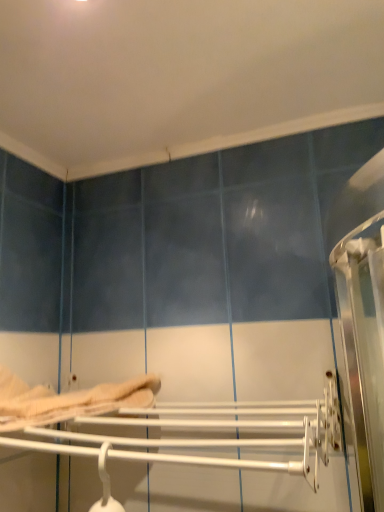
Describe the element at coordinates (67, 400) in the screenshot. Image resolution: width=384 pixels, height=512 pixels. I see `beige fabric bed at lower left` at that location.

Where is `beige fabric bed at lower left`? This screenshot has height=512, width=384. beige fabric bed at lower left is located at coordinates pos(67,400).

Image resolution: width=384 pixels, height=512 pixels. Describe the element at coordinates (179, 428) in the screenshot. I see `white glossy towel rack at center` at that location.

Measure the distance between point (244, 438) and camera.

Point (244, 438) and camera are 26.85 inches apart from each other.

At what (x,y) coordinates should I click in order to perform the action: click on white glossy towel rack at center. Please return your answer as a coordinate pair (x, y). Looking at the image, I should click on (179, 428).

Identify the location of beige fabric bed at lower left. (67, 400).

Can you confirm if white glossy towel rack at center is positioned to the left of beige fabric bed at lower left?

No.

In the image, is white glossy towel rack at center positioned in front of or behind beige fabric bed at lower left?

In the image, white glossy towel rack at center appears in front of beige fabric bed at lower left.

Does point (184, 415) come closer to viewer compared to point (140, 396)?

That is True.

Based on the photo, from the image's perspective, is white glossy towel rack at center above beige fabric bed at lower left?

Incorrect, from the image's perspective, white glossy towel rack at center is lower than beige fabric bed at lower left.

Consider the image. From a real-world perspective, who is located higher, white glossy towel rack at center or beige fabric bed at lower left?

beige fabric bed at lower left, from a real-world perspective.

Considering the relative sizes of white glossy towel rack at center and beige fabric bed at lower left in the image provided, is white glossy towel rack at center wider than beige fabric bed at lower left?

Yes, white glossy towel rack at center is wider than beige fabric bed at lower left.

Who is taller, white glossy towel rack at center or beige fabric bed at lower left?

white glossy towel rack at center.

Does white glossy towel rack at center have a larger size compared to beige fabric bed at lower left?

Yes, white glossy towel rack at center is bigger than beige fabric bed at lower left.

Is white glossy towel rack at center situated inside beige fabric bed at lower left or outside?

white glossy towel rack at center is not enclosed by beige fabric bed at lower left.

Is white glossy towel rack at center far from beige fabric bed at lower left?

No, there isn't a large distance between white glossy towel rack at center and beige fabric bed at lower left.

Does white glossy towel rack at center turn towards beige fabric bed at lower left?

No, white glossy towel rack at center does not turn towards beige fabric bed at lower left.

In the scene shown: How many degrees apart are the facing directions of white glossy towel rack at center and beige fabric bed at lower left?

1.67 degrees.

Locate an element on the screen. This screenshot has width=384, height=512. bed behind the white glossy towel rack at center is located at coordinates tap(67, 400).

Between beige fabric bed at lower left and white glossy towel rack at center, which one appears on the left side from the viewer's perspective?

Positioned to the left is beige fabric bed at lower left.

Is beige fabric bed at lower left in front of or behind white glossy towel rack at center in the image?

beige fabric bed at lower left is behind white glossy towel rack at center.

Considering the positions of points (138, 395) and (108, 432), is point (138, 395) closer to camera compared to point (108, 432)?

That is True.

From the image's perspective, does beige fabric bed at lower left appear lower than white glossy towel rack at center?

No, from the image's perspective, beige fabric bed at lower left is not below white glossy towel rack at center.

From a real-world perspective, which object rests below the other?

In real-world perspective, white glossy towel rack at center is lower.

In the scene shown: Considering the sizes of objects beige fabric bed at lower left and white glossy towel rack at center in the image provided, who is wider, beige fabric bed at lower left or white glossy towel rack at center?

white glossy towel rack at center.

Consider the image. In terms of height, does beige fabric bed at lower left look taller or shorter compared to white glossy towel rack at center?

Clearly, beige fabric bed at lower left is shorter compared to white glossy towel rack at center.

Can you confirm if beige fabric bed at lower left is bigger than white glossy towel rack at center?

Actually, beige fabric bed at lower left might be smaller than white glossy towel rack at center.

Looking at this image, is beige fabric bed at lower left inside or outside of white glossy towel rack at center?

beige fabric bed at lower left exists outside the volume of white glossy towel rack at center.

Can you see beige fabric bed at lower left touching white glossy towel rack at center?

beige fabric bed at lower left is not next to white glossy towel rack at center, and they're not touching.

Could you tell me if beige fabric bed at lower left is facing white glossy towel rack at center?

No, beige fabric bed at lower left is not oriented towards white glossy towel rack at center.

Identify the location of bed lying on the left of white glossy towel rack at center. (67, 400).

At what (x,y) coordinates should I click in order to perform the action: click on towel rack that is below the beige fabric bed at lower left (from the image's perspective). Please return your answer as a coordinate pair (x, y). Looking at the image, I should click on (179, 428).

Locate an element on the screen. This screenshot has height=512, width=384. towel rack on the right side of beige fabric bed at lower left is located at coordinates (179, 428).